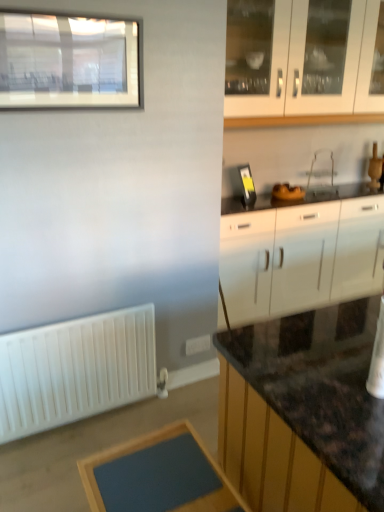
Question: Is clear plastic sink at center closer to the viewer compared to white matte radiator at lower left?

Choices:
 (A) no
 (B) yes

Answer: (A)

Question: Can you confirm if clear plastic sink at center is thinner than white matte radiator at lower left?

Choices:
 (A) yes
 (B) no

Answer: (B)

Question: Does clear plastic sink at center appear on the right side of white matte radiator at lower left?

Choices:
 (A) no
 (B) yes

Answer: (B)

Question: Is clear plastic sink at center placed right next to white matte radiator at lower left?

Choices:
 (A) no
 (B) yes

Answer: (A)

Question: From the image's perspective, is clear plastic sink at center on top of white matte radiator at lower left?

Choices:
 (A) no
 (B) yes

Answer: (B)

Question: Does clear plastic sink at center have a greater height compared to white matte radiator at lower left?

Choices:
 (A) yes
 (B) no

Answer: (B)

Question: Is matte glass window at upper left a part of white glossy cabinet at right, which appears as the second cabinetry when viewed from the top?

Choices:
 (A) no
 (B) yes

Answer: (A)

Question: From the image's perspective, is white glossy cabinet at right, the first cabinetry positioned from the bottom, on matte glass window at upper left?

Choices:
 (A) yes
 (B) no

Answer: (B)

Question: Can you confirm if white glossy cabinet at right, the first cabinetry positioned from the bottom, is wider than matte glass window at upper left?

Choices:
 (A) no
 (B) yes

Answer: (B)

Question: From the image's perspective, does white glossy cabinet at right, which appears as the second cabinetry when viewed from the top, appear lower than matte glass window at upper left?

Choices:
 (A) yes
 (B) no

Answer: (A)

Question: Is white glossy cabinet at right, the first cabinetry positioned from the bottom, completely or partially outside of matte glass window at upper left?

Choices:
 (A) no
 (B) yes

Answer: (B)

Question: Is white glossy cabinet at right, which appears as the second cabinetry when viewed from the top, at the left side of matte glass window at upper left?

Choices:
 (A) no
 (B) yes

Answer: (A)

Question: From the image's perspective, is matte glass window at upper left under blue matte table at lower center?

Choices:
 (A) no
 (B) yes

Answer: (A)